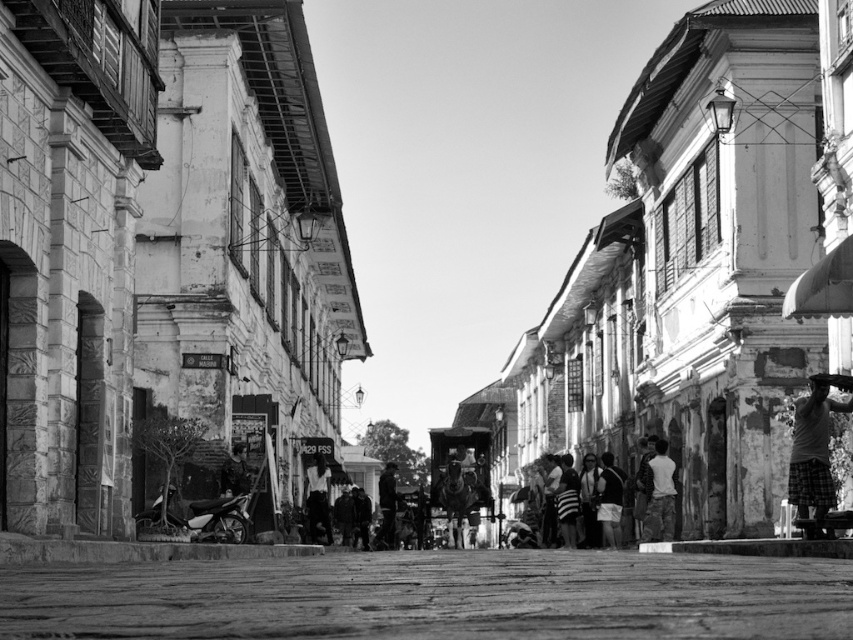
You are a tailor observing a street scene with a plaid fabric skateboarder at right and a light gray fabric shirt at lower right. Which fabric has a bigger size?

The plaid fabric skateboarder at right is larger in size than the light gray fabric shirt at lower right, so the plaid fabric skateboarder at right has a bigger size.